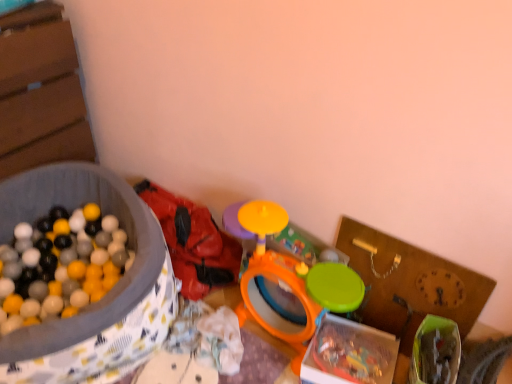
Question: Considering the positions of matte plastic ball pit at left, arranged as the first box when viewed from the left, and orange plastic drum at center, arranged as the 2th toy when viewed from the left, in the image, is matte plastic ball pit at left, arranged as the first box when viewed from the left, taller or shorter than orange plastic drum at center, arranged as the 2th toy when viewed from the left,?

Choices:
 (A) tall
 (B) short

Answer: (A)

Question: Considering the relative positions of matte plastic ball pit at left, placed as the 2th box when sorted from right to left, and orange plastic drum at center, the first toy viewed from the right, in the image provided, is matte plastic ball pit at left, placed as the 2th box when sorted from right to left, to the left or to the right of orange plastic drum at center, the first toy viewed from the right,?

Choices:
 (A) left
 (B) right

Answer: (A)

Question: Which object is positioned closest to the orange plastic drum at center, the first toy viewed from the right?

Choices:
 (A) rubberized red backpack at center, arranged as the 2th toy when viewed from the right
 (B) wooden clock at right
 (C) translucent plastic box at center, positioned as the 2th box in left-to-right order
 (D) matte plastic ball pit at left, placed as the 2th box when sorted from right to left

Answer: (C)

Question: Considering the real-world distances, which object is farthest from the orange plastic drum at center, arranged as the 2th toy when viewed from the left?

Choices:
 (A) translucent plastic box at center, positioned as the 2th box in left-to-right order
 (B) rubberized red backpack at center, which is counted as the 1th toy, starting from the left
 (C) wooden clock at right
 (D) matte plastic ball pit at left, arranged as the first box when viewed from the left

Answer: (D)